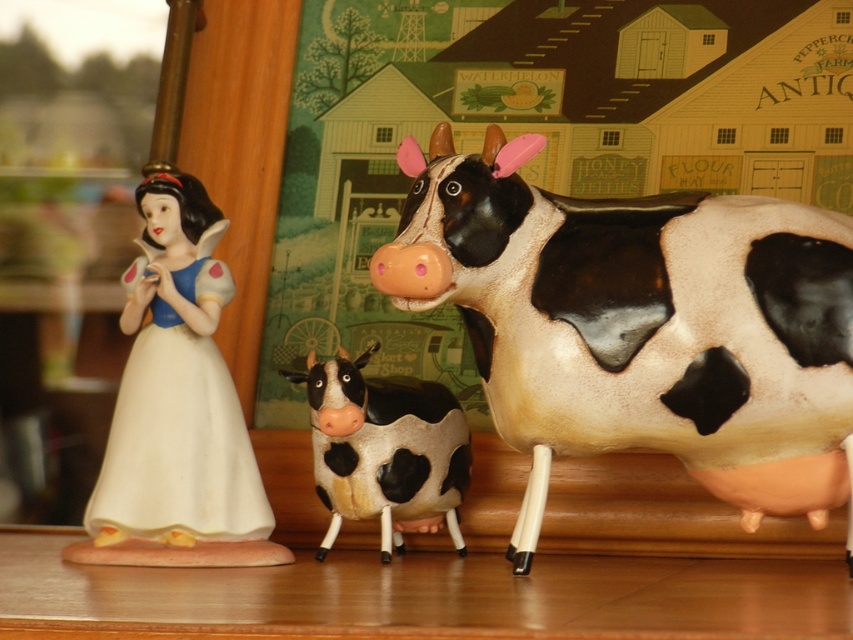
Does porcelain doll at left appear on the right side of black and white ceramic cow at center?

Incorrect, porcelain doll at left is not on the right side of black and white ceramic cow at center.

Is porcelain doll at left positioned in front of black and white ceramic cow at center?

That is True.

Who is more distant from viewer, (x=198, y=371) or (x=397, y=410)?

Positioned behind is point (x=397, y=410).

Find the location of a particular element. This screenshot has width=853, height=640. porcelain doll at left is located at coordinates (177, 406).

Between black and white glossy cow at right and porcelain doll at left, which one is positioned higher?

Positioned higher is black and white glossy cow at right.

Who is shorter, black and white glossy cow at right or porcelain doll at left?

With less height is porcelain doll at left.

Who is more forward, (773, 259) or (207, 211)?

Positioned in front is point (773, 259).

Locate an element on the screen. The height and width of the screenshot is (640, 853). black and white glossy cow at right is located at coordinates (639, 324).

Which is more to the right, black and white glossy cow at right or black and white ceramic cow at center?

From the viewer's perspective, black and white glossy cow at right appears more on the right side.

Is black and white glossy cow at right smaller than black and white ceramic cow at center?

No.

Does point (476, 346) come closer to viewer compared to point (381, 388)?

Yes, it is.

Identify the location of black and white glossy cow at right. The width and height of the screenshot is (853, 640). (639, 324).